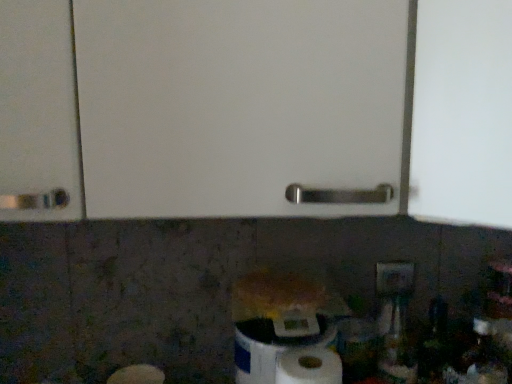
Identify the location of white matte toilet paper at lower center. Image resolution: width=512 pixels, height=384 pixels. (275, 345).

From the image's perspective, is white plastic electric outlet at lower right located above or below white matte paper towel at lower center?

white plastic electric outlet at lower right is above white matte paper towel at lower center.

Find the location of a particular element. electric outlet that is on the right side of white matte paper towel at lower center is located at coordinates (394, 279).

Is white plastic electric outlet at lower right not inside white matte paper towel at lower center?

Yes, white plastic electric outlet at lower right is outside of white matte paper towel at lower center.

In the scene shown: Is white plastic electric outlet at lower right wider than white matte paper towel at lower center?

In fact, white plastic electric outlet at lower right might be narrower than white matte paper towel at lower center.

Where is `toilet paper located on the left of white matte paper towel at lower center`? Image resolution: width=512 pixels, height=384 pixels. toilet paper located on the left of white matte paper towel at lower center is located at coordinates (275, 345).

Is white matte toilet paper at lower center oriented away from white matte paper towel at lower center?

No, white matte toilet paper at lower center's orientation is not away from white matte paper towel at lower center.

Is white matte toilet paper at lower center not close to white matte paper towel at lower center?

That's not correct — white matte toilet paper at lower center is a little close to white matte paper towel at lower center.

Considering the sizes of objects white matte toilet paper at lower center and white matte paper towel at lower center in the image provided, who is bigger, white matte toilet paper at lower center or white matte paper towel at lower center?

white matte toilet paper at lower center is bigger.

Does white plastic electric outlet at lower right have a smaller size compared to white matte toilet paper at lower center?

Yes, white plastic electric outlet at lower right is smaller than white matte toilet paper at lower center.

From a real-world perspective, who is located lower, white plastic electric outlet at lower right or white matte toilet paper at lower center?

In real-world perspective, white matte toilet paper at lower center is lower.

From the image's perspective, is white plastic electric outlet at lower right located beneath white matte toilet paper at lower center?

No.

Is white plastic electric outlet at lower right taller than white matte toilet paper at lower center?

Incorrect, the height of white plastic electric outlet at lower right is not larger of that of white matte toilet paper at lower center.

Is white matte paper towel at lower center located outside white plastic electric outlet at lower right?

Yes, white matte paper towel at lower center is outside of white plastic electric outlet at lower right.

Does white matte paper towel at lower center have a larger size compared to white plastic electric outlet at lower right?

Indeed, white matte paper towel at lower center has a larger size compared to white plastic electric outlet at lower right.

Can you confirm if white matte paper towel at lower center is positioned to the left of white plastic electric outlet at lower right?

Correct, you'll find white matte paper towel at lower center to the left of white plastic electric outlet at lower right.

From a real-world perspective, is white matte toilet paper at lower center over white plastic electric outlet at lower right?

No, from a real-world perspective, white matte toilet paper at lower center is not over white plastic electric outlet at lower right

Could you measure the distance between white matte toilet paper at lower center and white plastic electric outlet at lower right?

white matte toilet paper at lower center is 28.35 centimeters away from white plastic electric outlet at lower right.

Is white matte toilet paper at lower center not close to white plastic electric outlet at lower right?

That's not correct — white matte toilet paper at lower center is a little close to white plastic electric outlet at lower right.

Is white matte toilet paper at lower center oriented away from white plastic electric outlet at lower right?

No, white matte toilet paper at lower center is not facing away from white plastic electric outlet at lower right.

The image size is (512, 384). Identify the location of toilet paper on the left side of white matte paper towel at lower center. (275, 345).

Between white matte paper towel at lower center and white matte toilet paper at lower center, which one has smaller size?

white matte paper towel at lower center.

From the picture: From a real-world perspective, between white matte paper towel at lower center and white matte toilet paper at lower center, who is vertically higher?

white matte toilet paper at lower center.

In the scene shown: Is white matte paper towel at lower center taller than white matte toilet paper at lower center?

Correct, white matte paper towel at lower center is much taller as white matte toilet paper at lower center.

Locate an element on the screen. This screenshot has height=384, width=512. electric outlet that appears above the white matte paper towel at lower center (from the image's perspective) is located at coordinates (394, 279).

The width and height of the screenshot is (512, 384). In order to click on toilet paper above the white matte paper towel at lower center (from a real-world perspective) in this screenshot , I will do `click(275, 345)`.

Based on the photo, based on their spatial positions, is white matte toilet paper at lower center or white matte paper towel at lower center closer to white plastic electric outlet at lower right?

The object closer to white plastic electric outlet at lower right is white matte toilet paper at lower center.

Which object lies nearer to the anchor point white matte paper towel at lower center, white matte toilet paper at lower center or white plastic electric outlet at lower right?

Among the two, white matte toilet paper at lower center is located nearer to white matte paper towel at lower center.

Looking at the image, which one is located further to white matte paper towel at lower center, white plastic electric outlet at lower right or white matte toilet paper at lower center?

white plastic electric outlet at lower right.

Looking at the image, which one is located closer to white matte toilet paper at lower center, white matte paper towel at lower center or white plastic electric outlet at lower right?

white matte paper towel at lower center lies closer to white matte toilet paper at lower center than the other object.

Estimate the real-world distances between objects in this image. Which object is further from white plastic electric outlet at lower right, white matte paper towel at lower center or white matte toilet paper at lower center?

Among the two, white matte paper towel at lower center is located further to white plastic electric outlet at lower right.

When comparing their distances from white matte toilet paper at lower center, does white plastic electric outlet at lower right or white matte paper towel at lower center seem closer?

Among the two, white matte paper towel at lower center is located nearer to white matte toilet paper at lower center.

Locate an element on the screen. This screenshot has width=512, height=384. toilet paper between white matte paper towel at lower center and white plastic electric outlet at lower right from front to back is located at coordinates (275, 345).